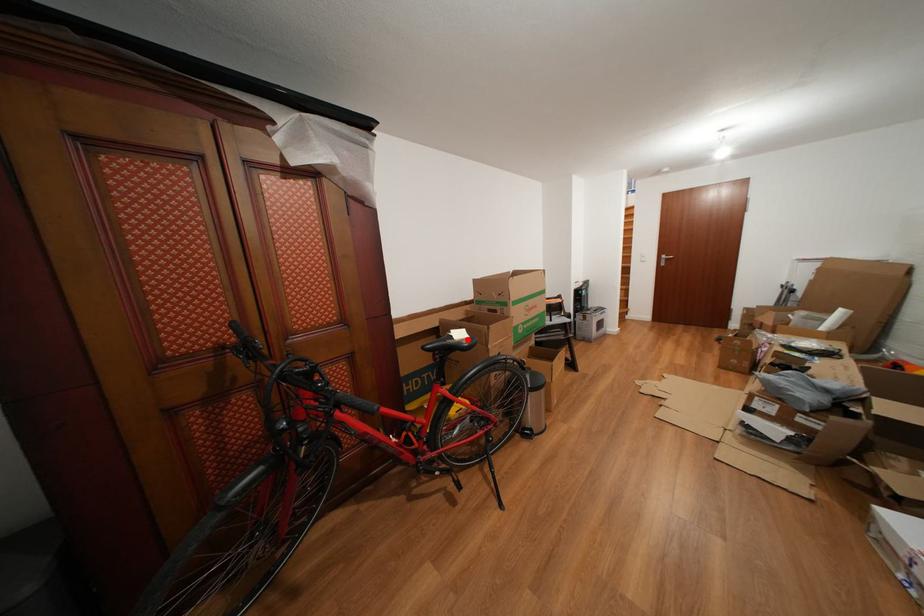
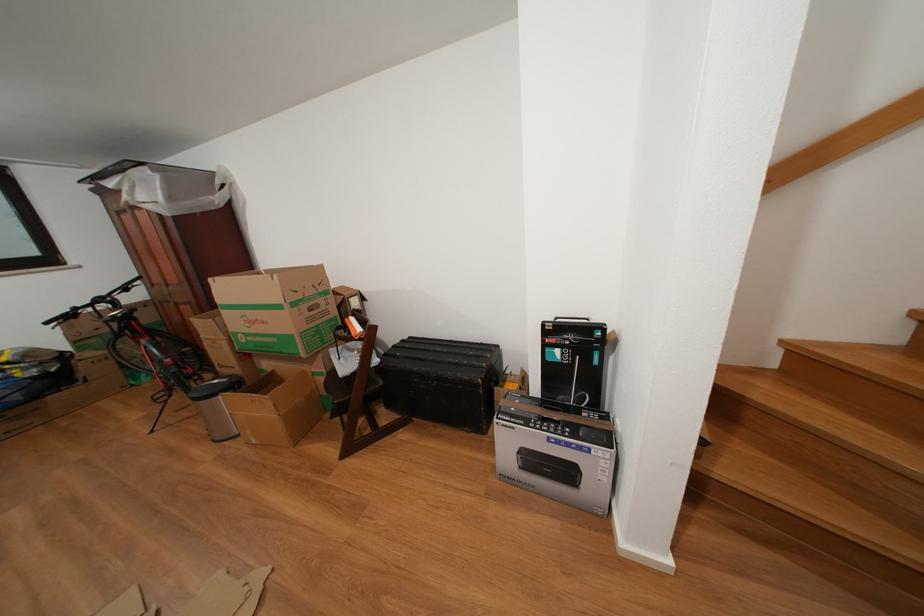
Find the pixel in the second image that matches the highlighted location in the first image.

(126, 317)